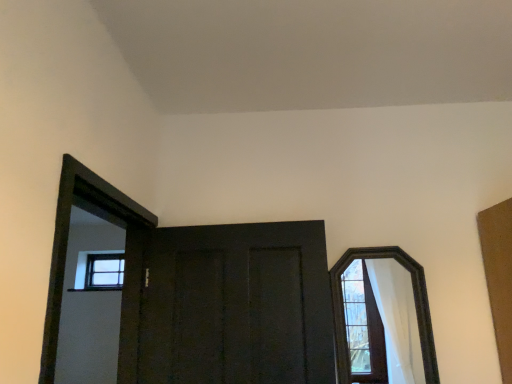
The width and height of the screenshot is (512, 384). Identify the location of matte black mirror at right. (383, 318).

In order to face matte black mirror at right, should I rotate leftwards or rightwards?

To face it directly, rotate right by 16.779 degrees.

Describe the element at coordinates (383, 318) in the screenshot. I see `matte black mirror at right` at that location.

The width and height of the screenshot is (512, 384). In order to click on matte black mirror at right in this screenshot , I will do `click(383, 318)`.